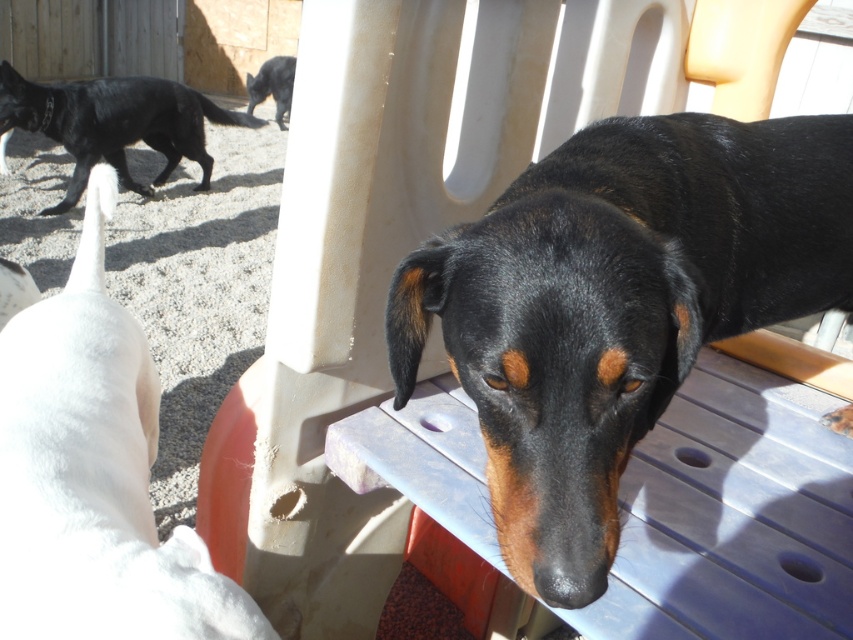
You are a photographer setting up a tripod to take a photo of the black glossy dog at upper left and the shiny black cat at upper left. The tripod has a height limit of 2 feet. Can both subjects be captured clearly without adjusting the tripod height?

The black glossy dog at upper left is taller than the shiny black cat at upper left. Since the tripod has a height limit of 2 feet, you need to ensure both subjects are within this height range. If the dog exceeds 2 feet in height, adjusting the tripod might be necessary for clarity.

You are trying to decide which pet to adopt. You see the white fur dog at lower left and the shiny black cat at upper left. Which one has a larger body size?

The white fur dog at lower left might be wider than shiny black cat at upper left, so the white fur dog at lower left likely has a larger body size.

You are planning to place a small water bowl for the dogs. The white fur dog at lower left and the black glossy dog at upper left are both in the area. Considering their sizes, which dog would require a smaller water bowl?

The white fur dog at lower left requires a smaller water bowl since it has a smaller size compared to the black glossy dog at upper left.